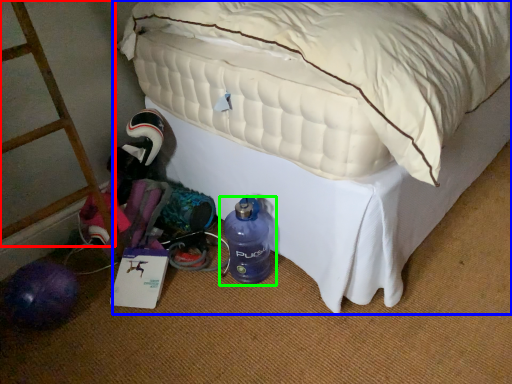
Question: Which object is the farthest from ladder (highlighted by a red box)? Choose among these: bed (highlighted by a blue box) or bottle (highlighted by a green box).

Choices:
 (A) bed
 (B) bottle

Answer: (A)